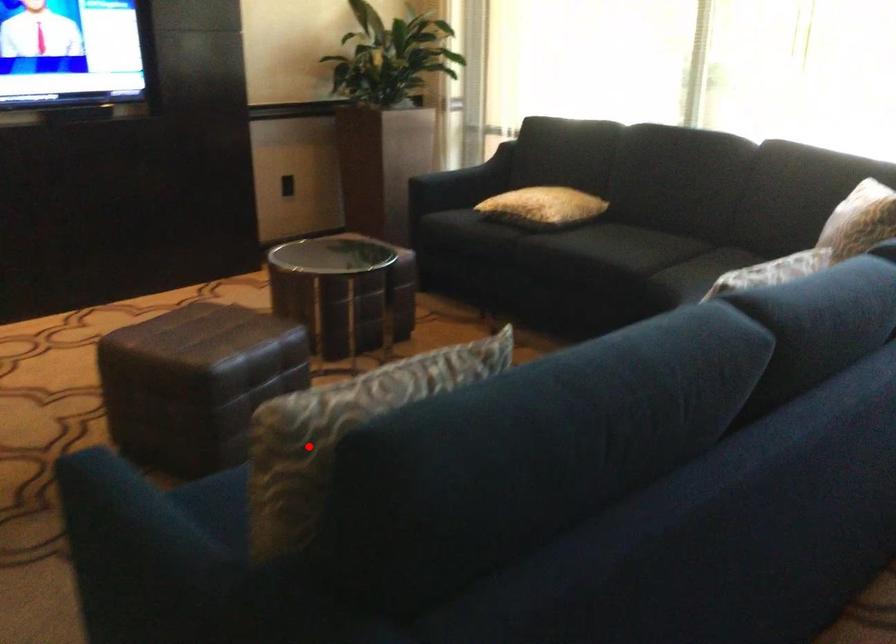
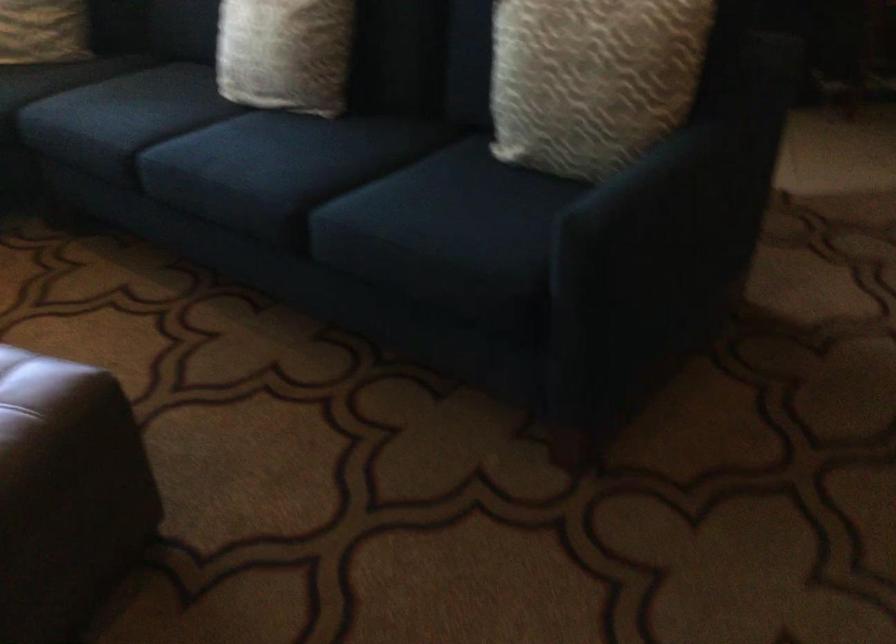
Question: I am providing you with two images of the same scene from different viewpoints. A red point is shown in image1. For the corresponding object point in image2, is it positioned nearer or farther from the camera?

Choices:
 (A) Nearer
 (B) Farther

Answer: (B)